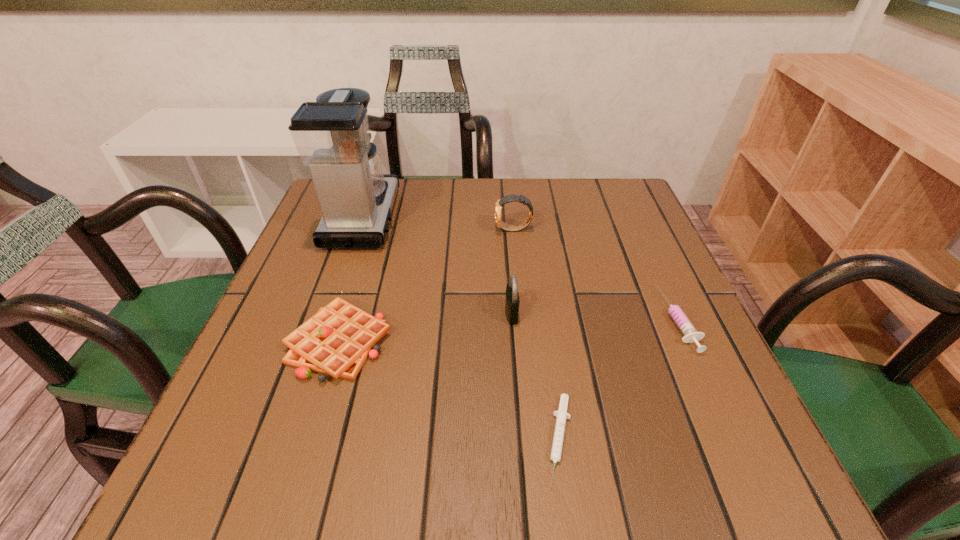
Identify the location of free space between the watch and the nearer syringe. (537, 335).

Where is `free spot between the watch and the waffle`? The image size is (960, 540). free spot between the watch and the waffle is located at coordinates (426, 286).

Identify the location of vacant region between the waffle and the padlock. This screenshot has height=540, width=960. (425, 328).

What are the coordinates of `blank region between the tallest object and the farther syringe` in the screenshot? It's located at (521, 269).

Find the location of a particular element. free space between the padlock and the right syringe is located at coordinates (596, 317).

This screenshot has height=540, width=960. I want to click on free point between the watch and the shortest object, so click(537, 335).

Find the location of a particular element. vacant region between the tallest object and the watch is located at coordinates (439, 224).

Find the location of a particular element. This screenshot has width=960, height=540. unoccupied position between the shortest object and the watch is located at coordinates (537, 335).

Image resolution: width=960 pixels, height=540 pixels. What are the coordinates of `unoccupied position between the fifth tallest object and the tallest object` in the screenshot? It's located at (521, 269).

The width and height of the screenshot is (960, 540). What are the coordinates of `object that is the closest to the taller syringe` in the screenshot? It's located at (561, 414).